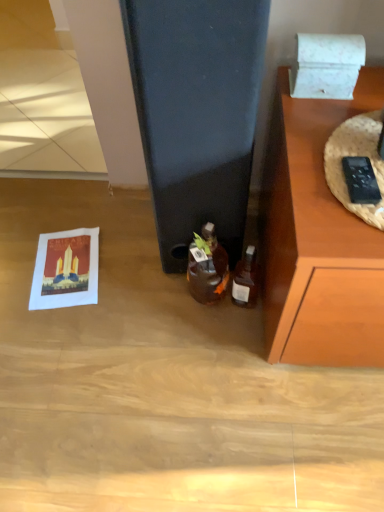
Identify the location of blank space to the left of translucent glass bottle at lower right, the 2th bottle when ordered from left to right. (178, 317).